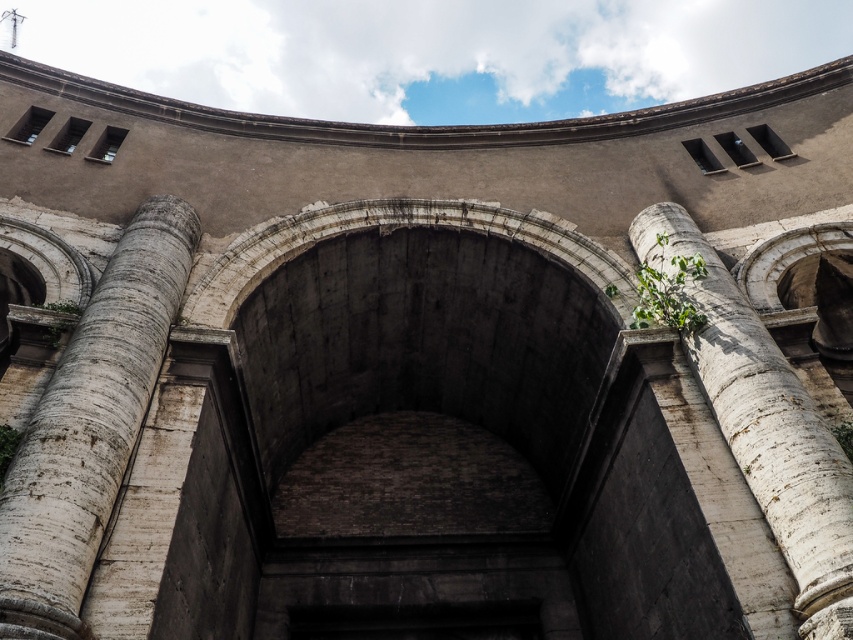
Based on the coordinates provided, can you identify which object corresponds to the point at (90, 424)?

The point at (90, 424) corresponds to the white marble column at center.

You are an architect examining the ancient structure. You notice the white marble column at center and the white marble column at right. Which column would you say is narrower in width?

The white marble column at center is narrower in width than the white marble column at right because it occupies less space.